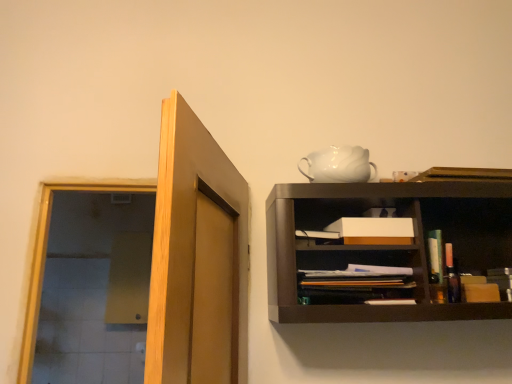
Question: Is white glossy teapot at upper center positioned far away from white matte box at center?

Choices:
 (A) no
 (B) yes

Answer: (A)

Question: Is white glossy teapot at upper center facing away from white matte box at center?

Choices:
 (A) no
 (B) yes

Answer: (A)

Question: Does white glossy teapot at upper center appear on the left side of white matte box at center?

Choices:
 (A) no
 (B) yes

Answer: (B)

Question: Considering the relative positions of white glossy teapot at upper center and white matte box at center in the image provided, is white glossy teapot at upper center behind white matte box at center?

Choices:
 (A) yes
 (B) no

Answer: (A)

Question: From a real-world perspective, is white glossy teapot at upper center physically below white matte box at center?

Choices:
 (A) yes
 (B) no

Answer: (B)

Question: From the image's perspective, is white glossy teapot at upper center under white matte box at center?

Choices:
 (A) no
 (B) yes

Answer: (A)

Question: From a real-world perspective, is light brown wood door at upper left on top of matte black book at center?

Choices:
 (A) yes
 (B) no

Answer: (A)

Question: Does light brown wood door at upper left have a lesser width compared to matte black book at center?

Choices:
 (A) yes
 (B) no

Answer: (B)

Question: Can you confirm if light brown wood door at upper left is bigger than matte black book at center?

Choices:
 (A) no
 (B) yes

Answer: (B)

Question: Could you tell me if light brown wood door at upper left is facing matte black book at center?

Choices:
 (A) yes
 (B) no

Answer: (B)

Question: Is light brown wood door at upper left shorter than matte black book at center?

Choices:
 (A) no
 (B) yes

Answer: (A)

Question: Is light brown wood door at upper left behind matte black book at center?

Choices:
 (A) no
 (B) yes

Answer: (A)

Question: From the image's perspective, does matte black book at center appear lower than light brown wood door at upper left?

Choices:
 (A) yes
 (B) no

Answer: (A)